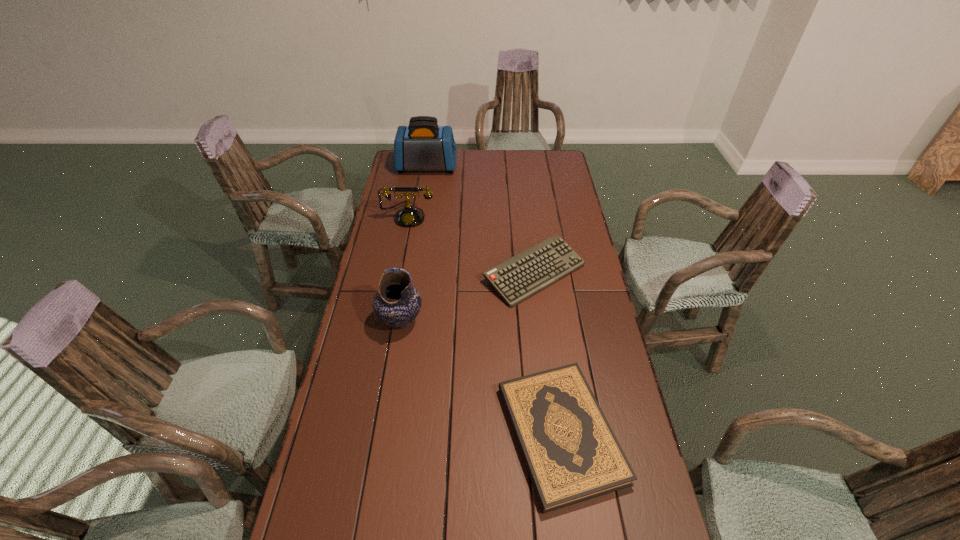
This screenshot has width=960, height=540. Find the location of `the tallest object`. the tallest object is located at coordinates (423, 145).

Image resolution: width=960 pixels, height=540 pixels. Find the location of `the farthest object`. the farthest object is located at coordinates (423, 145).

Locate an element on the screen. Image resolution: width=960 pixels, height=540 pixels. the fourth shortest object is located at coordinates (397, 303).

Where is `the second farthest object`? This screenshot has height=540, width=960. the second farthest object is located at coordinates (409, 216).

This screenshot has width=960, height=540. Find the location of `the third shortest object`. the third shortest object is located at coordinates (409, 216).

I want to click on the second shortest object, so click(x=521, y=276).

Locate an element on the screen. The height and width of the screenshot is (540, 960). the shortest object is located at coordinates [x=572, y=455].

The image size is (960, 540). In order to click on hardback book in this screenshot , I will do `click(572, 455)`.

The height and width of the screenshot is (540, 960). I want to click on free region located on the front-facing side of the farthest object, so click(509, 167).

I want to click on vacant point located 0.400m on the front of the fourth shortest object, so click(377, 463).